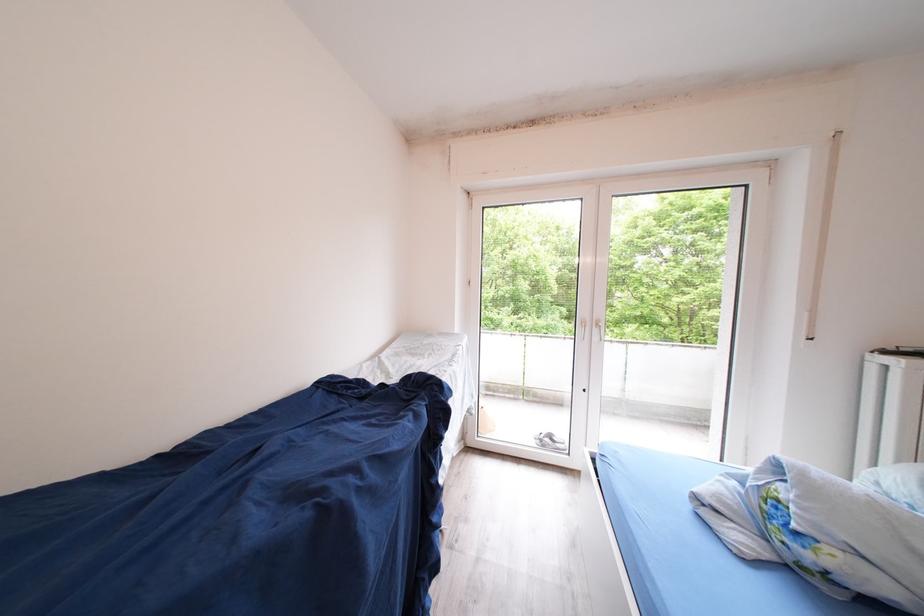
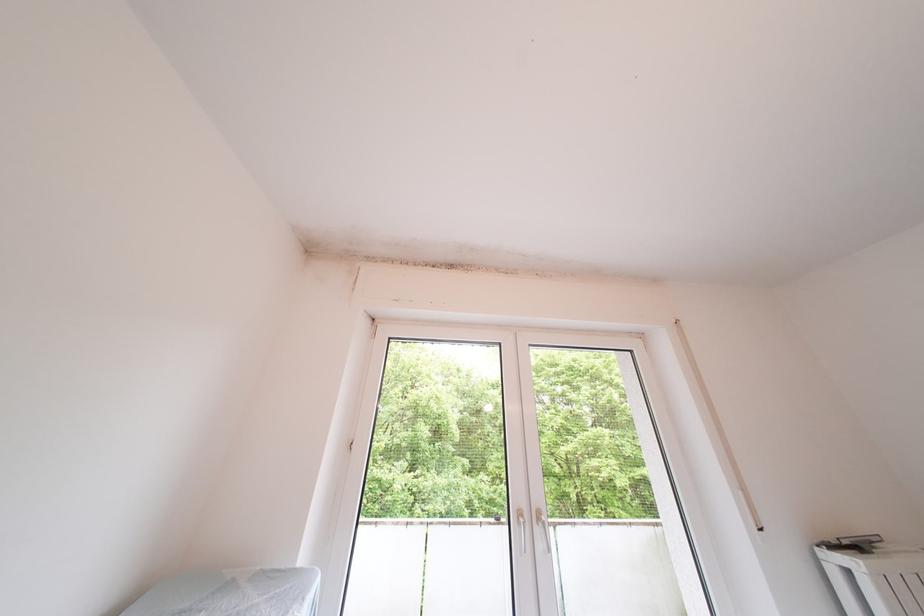
The images are taken continuously from a first-person perspective. In which direction is your viewpoint rotating?

The camera rotated toward right-up.